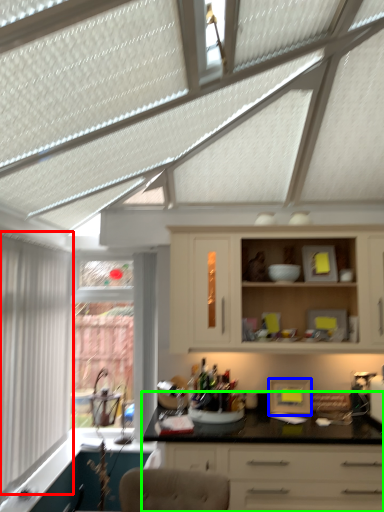
Question: Which object is positioned closest to window (highlighted by a red box)? Select from appliance (highlighted by a blue box) and countertop (highlighted by a green box).

Choices:
 (A) appliance
 (B) countertop

Answer: (B)